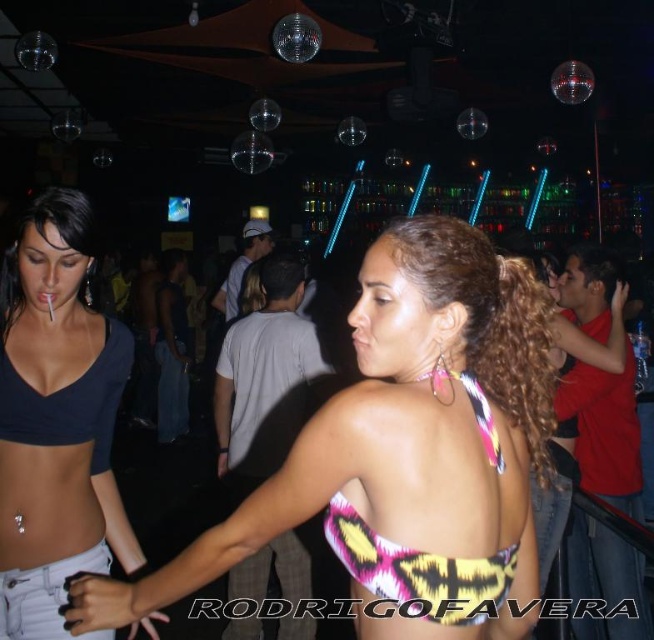
In the scene shown: Which of these two, printed fabric bikini top at center or multicolored fabric bikini top at center, stands taller?

printed fabric bikini top at center is taller.

What do you see at coordinates (404, 451) in the screenshot? I see `printed fabric bikini top at center` at bounding box center [404, 451].

The height and width of the screenshot is (640, 654). In order to click on printed fabric bikini top at center in this screenshot , I will do `click(404, 451)`.

Can you confirm if printed fabric bikini top at center is positioned above matte black top at left?

Actually, printed fabric bikini top at center is below matte black top at left.

Is point (165, 595) in front of point (27, 552)?

That is True.

Is point (481, 625) closer to camera compared to point (7, 406)?

Yes, point (481, 625) is in front of point (7, 406).

In order to click on printed fabric bikini top at center in this screenshot , I will do `click(404, 451)`.

Is matte black top at left wider than multicolored fabric bikini top at center?

Yes.

Does matte black top at left lie in front of multicolored fabric bikini top at center?

No, it is behind multicolored fabric bikini top at center.

Locate an element on the screen. Image resolution: width=654 pixels, height=640 pixels. matte black top at left is located at coordinates 56,394.